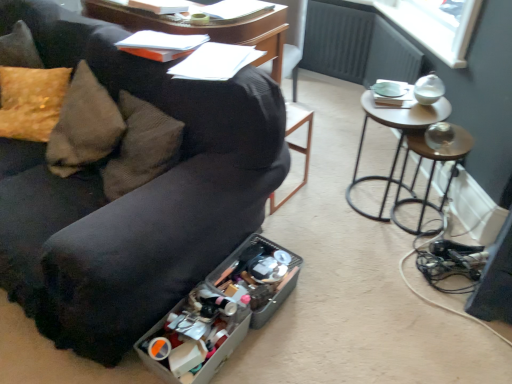
Question: Does translucent plastic storage box at lower center, arranged as the second storage box when viewed from the back, appear on the left side of black leather bar stool at center?

Choices:
 (A) no
 (B) yes

Answer: (B)

Question: Is translucent plastic storage box at lower center, the first storage box positioned from the front, placed right next to black leather bar stool at center?

Choices:
 (A) no
 (B) yes

Answer: (A)

Question: Could black leather bar stool at center be considered to be inside translucent plastic storage box at lower center, the first storage box positioned from the front?

Choices:
 (A) no
 (B) yes

Answer: (A)

Question: From the image's perspective, does translucent plastic storage box at lower center, arranged as the second storage box when viewed from the back, appear lower than black leather bar stool at center?

Choices:
 (A) no
 (B) yes

Answer: (B)

Question: Does translucent plastic storage box at lower center, the first storage box positioned from the front, appear on the right side of black leather bar stool at center?

Choices:
 (A) no
 (B) yes

Answer: (A)

Question: Looking at the image, does black leather bar stool at center seem bigger or smaller compared to metallic brown stool at right?

Choices:
 (A) big
 (B) small

Answer: (A)

Question: Considering their positions, is black leather bar stool at center located in front of or behind metallic brown stool at right?

Choices:
 (A) front
 (B) behind

Answer: (A)

Question: Considering the positions of black leather bar stool at center and metallic brown stool at right in the image, is black leather bar stool at center taller or shorter than metallic brown stool at right?

Choices:
 (A) tall
 (B) short

Answer: (A)

Question: From the image's perspective, relative to metallic brown stool at right, is black leather bar stool at center above or below?

Choices:
 (A) below
 (B) above

Answer: (B)

Question: Considering the positions of translucent plastic storage box at lower center, the first storage box positioned from the front, and translucent plastic container at lower center, the first storage box viewed from the back, in the image, is translucent plastic storage box at lower center, the first storage box positioned from the front, bigger or smaller than translucent plastic container at lower center, the first storage box viewed from the back,?

Choices:
 (A) small
 (B) big

Answer: (A)

Question: From their relative heights in the image, would you say translucent plastic storage box at lower center, the first storage box positioned from the front, is taller or shorter than translucent plastic container at lower center, positioned as the second storage box in front-to-back order?

Choices:
 (A) tall
 (B) short

Answer: (B)

Question: From the image's perspective, is translucent plastic storage box at lower center, arranged as the second storage box when viewed from the back, located above or below translucent plastic container at lower center, positioned as the second storage box in front-to-back order?

Choices:
 (A) below
 (B) above

Answer: (A)

Question: From a real-world perspective, is translucent plastic storage box at lower center, the first storage box positioned from the front, physically located above or below translucent plastic container at lower center, the first storage box viewed from the back?

Choices:
 (A) above
 (B) below

Answer: (A)

Question: Looking at their shapes, would you say metallic brown stool at right is wider or thinner than black leather bar stool at center?

Choices:
 (A) thin
 (B) wide

Answer: (A)

Question: Choose the correct answer: Is metallic brown stool at right inside black leather bar stool at center or outside it?

Choices:
 (A) outside
 (B) inside

Answer: (A)